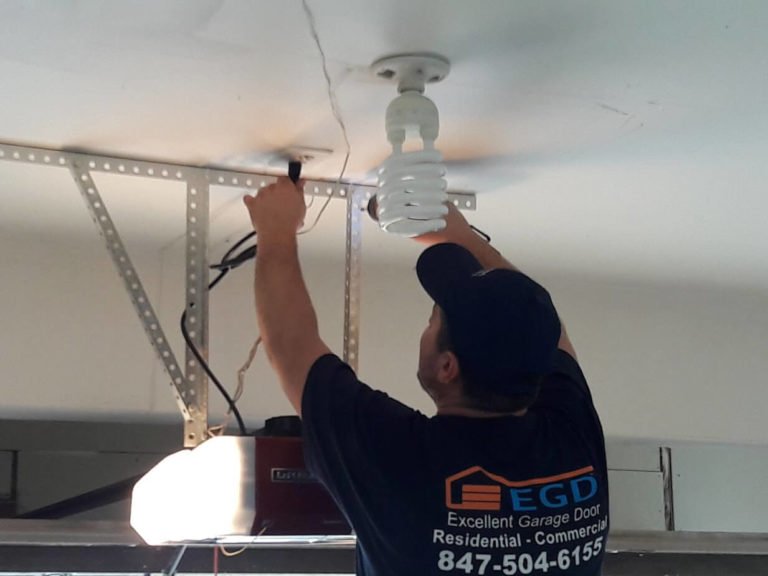
Image resolution: width=768 pixels, height=576 pixels. Find the location of `ceiling`. ceiling is located at coordinates [164, 75], [607, 108].